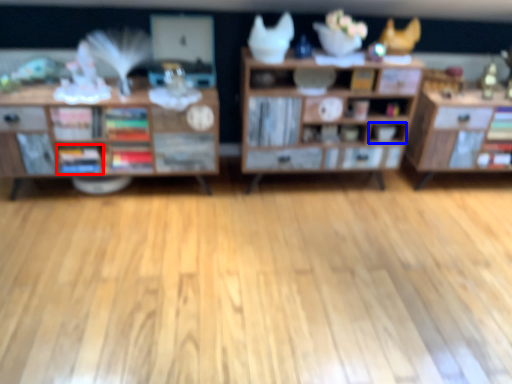
Question: Which point is further to the camera, book (highlighted by a red box) or cabinet (highlighted by a blue box)?

Choices:
 (A) book
 (B) cabinet

Answer: (B)